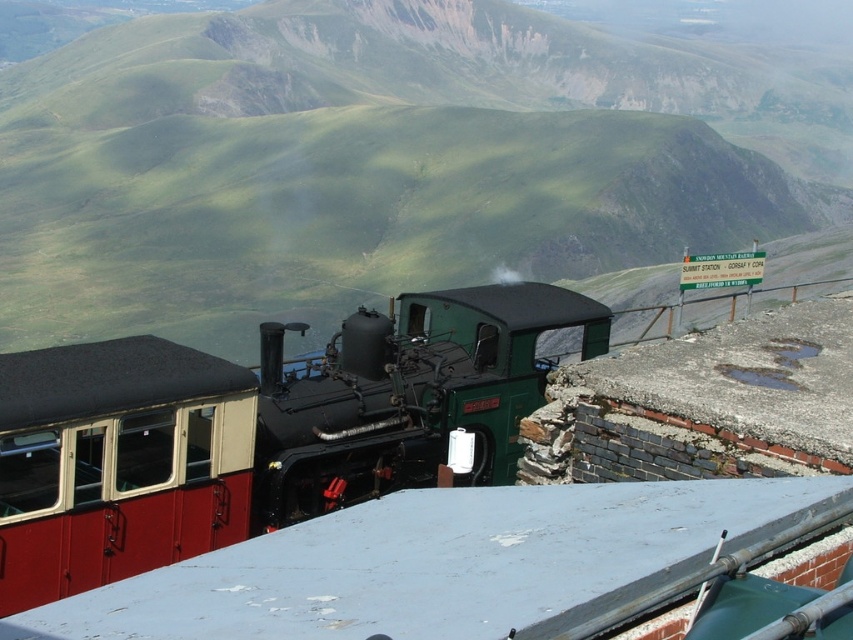
Question: Can you confirm if red polished wood train at center is positioned above green polished metal steam engine at center?

Choices:
 (A) no
 (B) yes

Answer: (A)

Question: Which point is closer to the camera taking this photo?

Choices:
 (A) (213, 449)
 (B) (193, 531)
 (C) (393, 337)

Answer: (A)

Question: Which of the following is the closest to the observer?

Choices:
 (A) green polished metal steam engine at center
 (B) red polished wood train car at lower left

Answer: (B)

Question: Based on their relative distances, which object is nearer to the green polished metal steam engine at center?

Choices:
 (A) red polished wood train car at lower left
 (B) red polished wood train at center

Answer: (A)

Question: In this image, where is red polished wood train at center located relative to green polished metal steam engine at center?

Choices:
 (A) left
 (B) right

Answer: (A)

Question: Can you confirm if red polished wood train car at lower left is positioned to the left of green polished metal steam engine at center?

Choices:
 (A) no
 (B) yes

Answer: (B)